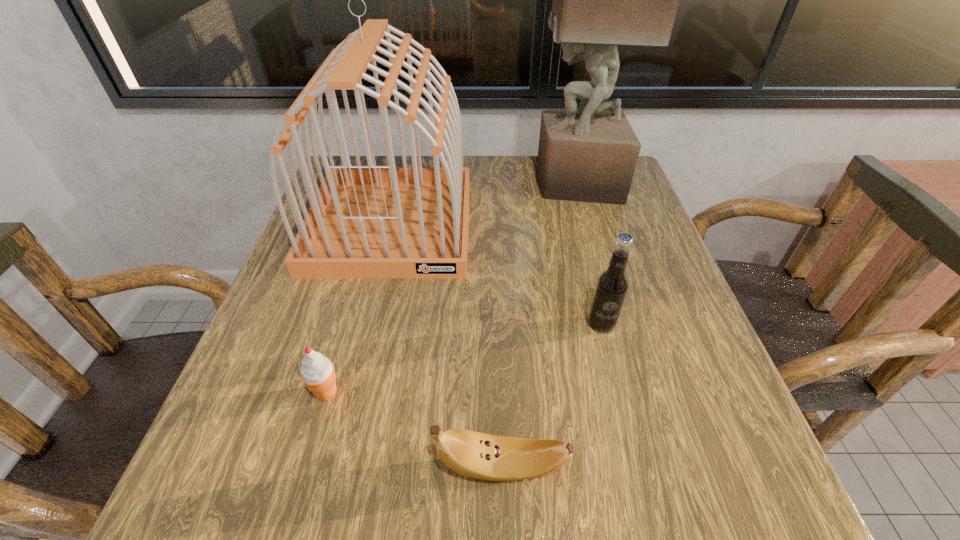
You are a GUI agent. You are given a task and a screenshot of the screen. Output one action in this format:
    pyautogui.click(x=<x>, y=<y>)
    Task: Click on the object that is at the far left corner
    The height and width of the screenshot is (540, 960).
    Given the screenshot: What is the action you would take?
    pyautogui.click(x=371, y=221)

The height and width of the screenshot is (540, 960). In order to click on object located at the far right corner in this screenshot , I will do `click(600, 0)`.

Locate an element on the screen. The image size is (960, 540). vacant space at the far edge is located at coordinates (470, 173).

Find the location of a particular element. free location at the near edge of the desktop is located at coordinates (604, 458).

The image size is (960, 540). In order to click on free point at the left edge in this screenshot , I will do `click(228, 397)`.

I want to click on free location at the right edge of the desktop, so click(x=630, y=289).

Find the location of a particular element. The width and height of the screenshot is (960, 540). vacant point located between the nearest object and the icecream is located at coordinates (415, 430).

The width and height of the screenshot is (960, 540). Identify the location of free space between the nearest object and the sculpture. (539, 325).

The height and width of the screenshot is (540, 960). What are the coordinates of `vacant space that's between the second nearest object and the root beer` in the screenshot? It's located at (464, 359).

Identify the location of empty space that is in between the second nearest object and the sculpture. [451, 288].